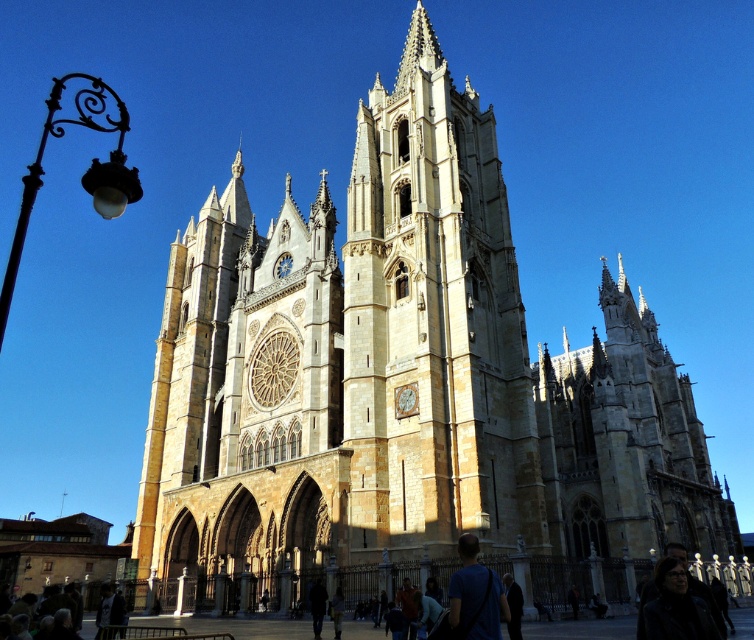
Question: Which point is farther from the camera taking this photo?

Choices:
 (A) (486, 588)
 (B) (694, 618)
 (C) (421, 394)

Answer: (C)

Question: Can you confirm if light beige stone tower at center is positioned above blue t-shirt at center?

Choices:
 (A) yes
 (B) no

Answer: (A)

Question: Is light beige stone tower at center behind dark leather jacket at lower right?

Choices:
 (A) yes
 (B) no

Answer: (A)

Question: Which point is farther to the camera?

Choices:
 (A) (544, 548)
 (B) (682, 570)

Answer: (A)

Question: Which point is farther to the camera?

Choices:
 (A) dark leather jacket at lower right
 (B) blue t-shirt at center

Answer: (B)

Question: Does light beige stone tower at center come in front of blue t-shirt at center?

Choices:
 (A) no
 (B) yes

Answer: (A)